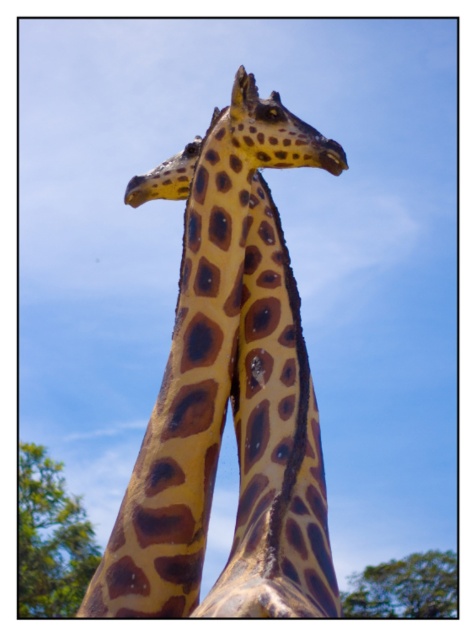
You are standing in a garden with two giraffe sculptures positioned closely together against a clear blue sky. You notice a point labeled at coordinates (50,538). What object is located at that point?

The point at coordinates (50,538) indicates a green leafy tree at lower left.

You are standing in a garden where the green leafy tree at lower left and the spotted fur giraffe head at center are present. Which object is taller?

The green leafy tree at lower left is much taller than the spotted fur giraffe head at center.